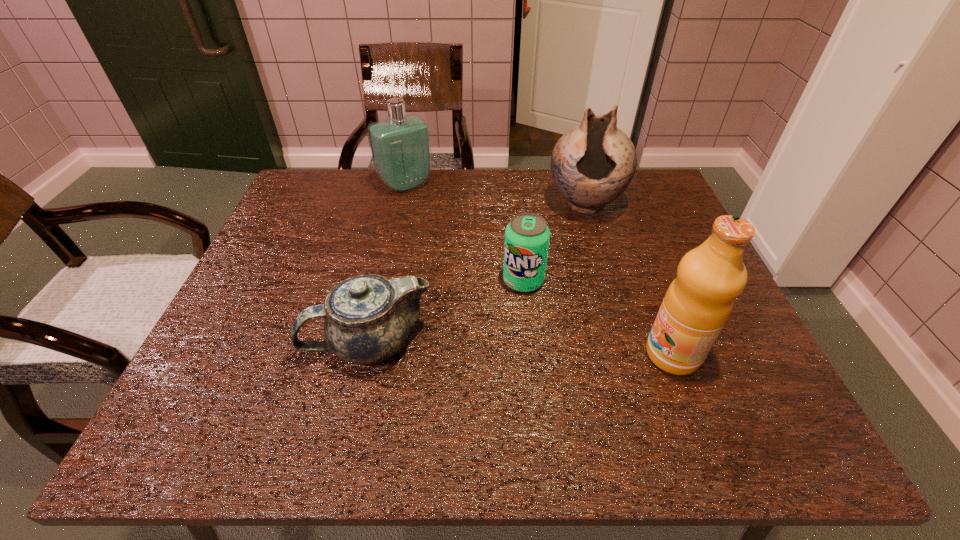
I want to click on vacant area between the chinaware and the fruit juice, so click(521, 348).

I want to click on free space between the third tallest object and the pottery, so click(495, 195).

Locate an element on the screen. This screenshot has width=960, height=540. free point between the fruit juice and the pottery is located at coordinates (629, 279).

The width and height of the screenshot is (960, 540). I want to click on object that is the fourth closest to the third farthest object, so click(401, 151).

Select which object appears as the fourth closest to the perfume. Please provide its 2D coordinates. Your answer should be formatted as a tuple, i.e. [(x, y)], where the tuple contains the x and y coordinates of a point satisfying the conditions above.

[(699, 301)]

The width and height of the screenshot is (960, 540). I want to click on vacant space that satisfies the following two spatial constraints: 1. on the front side of the fruit juice; 2. on the front label of the third farthest object, so click(x=531, y=354).

Identify the location of free space that satisfies the following two spatial constraints: 1. on the front side of the pottery; 2. on the front label of the fruit juice. (629, 354).

The width and height of the screenshot is (960, 540). Identify the location of free location that satisfies the following two spatial constraints: 1. on the front side of the pottery; 2. on the front label of the fruit juice. (629, 354).